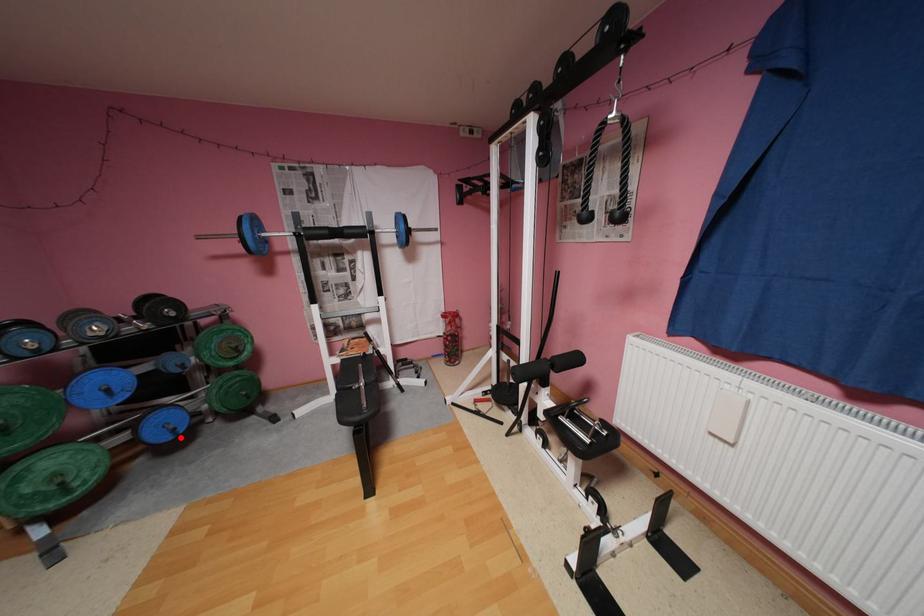
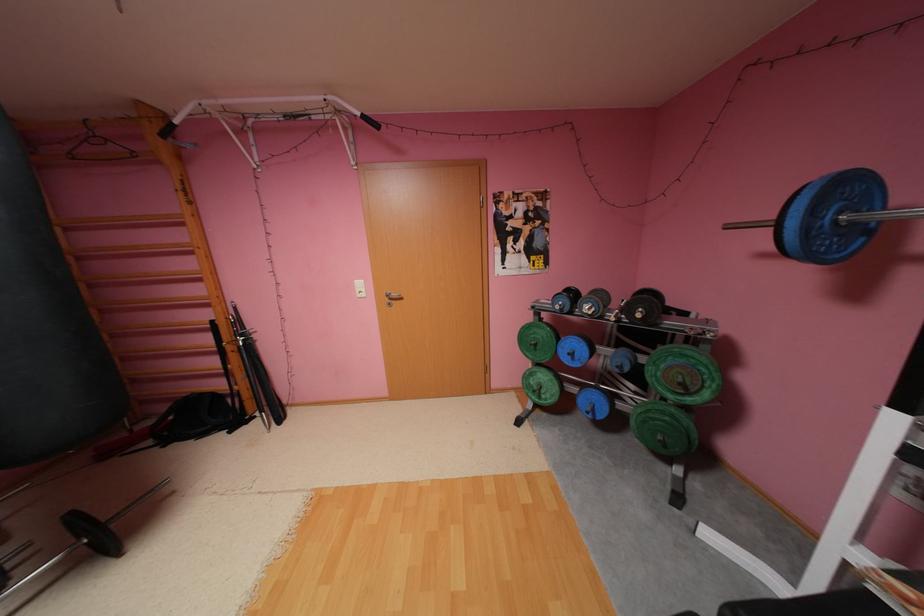
Where in the second image is the point corresponding to the highlighted location from the first image?

(600, 416)